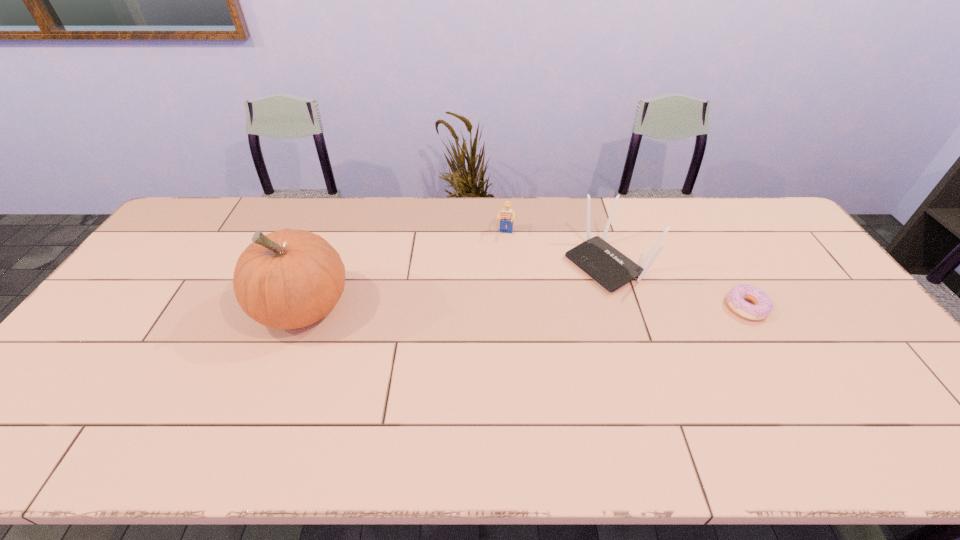
Image resolution: width=960 pixels, height=540 pixels. I want to click on pumpkin, so click(x=288, y=279).

This screenshot has width=960, height=540. In order to click on the tallest object in this screenshot , I will do `click(288, 279)`.

This screenshot has height=540, width=960. I want to click on doughnut, so click(763, 307).

I want to click on the rightmost object, so click(x=763, y=307).

The width and height of the screenshot is (960, 540). Identify the location of Lego. (507, 216).

This screenshot has height=540, width=960. What are the coordinates of `the second object from left to right` in the screenshot? It's located at (507, 216).

What are the coordinates of `the second object from right to left` in the screenshot? It's located at (611, 269).

The width and height of the screenshot is (960, 540). Find the location of `the second tallest object`. the second tallest object is located at coordinates (611, 269).

Identify the location of free point located on the stem of the pumpkin. (149, 307).

Locate an element on the screen. free space located on the stem of the pumpkin is located at coordinates (226, 307).